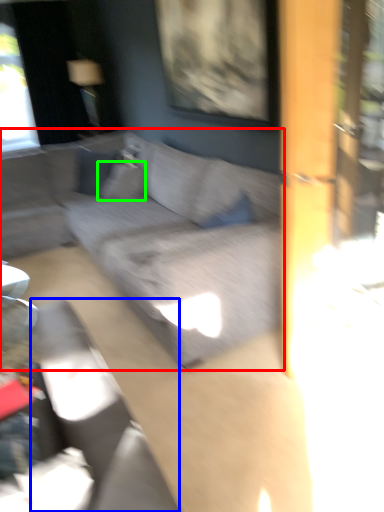
Question: Estimate the real-world distances between objects in this image. Which object is farther from studio couch (highlighted by a red box), swivel chair (highlighted by a blue box) or pillow (highlighted by a green box)?

Choices:
 (A) swivel chair
 (B) pillow

Answer: (A)